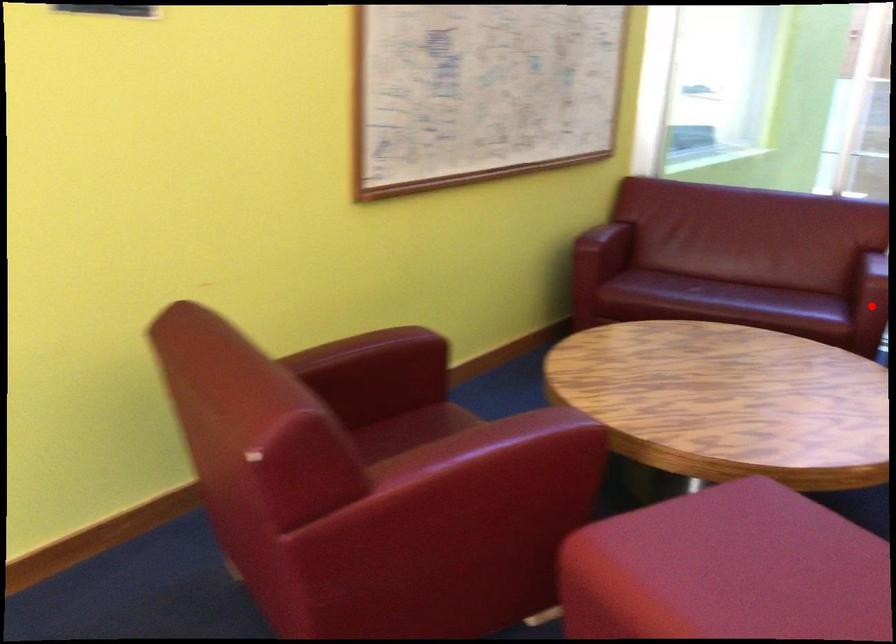
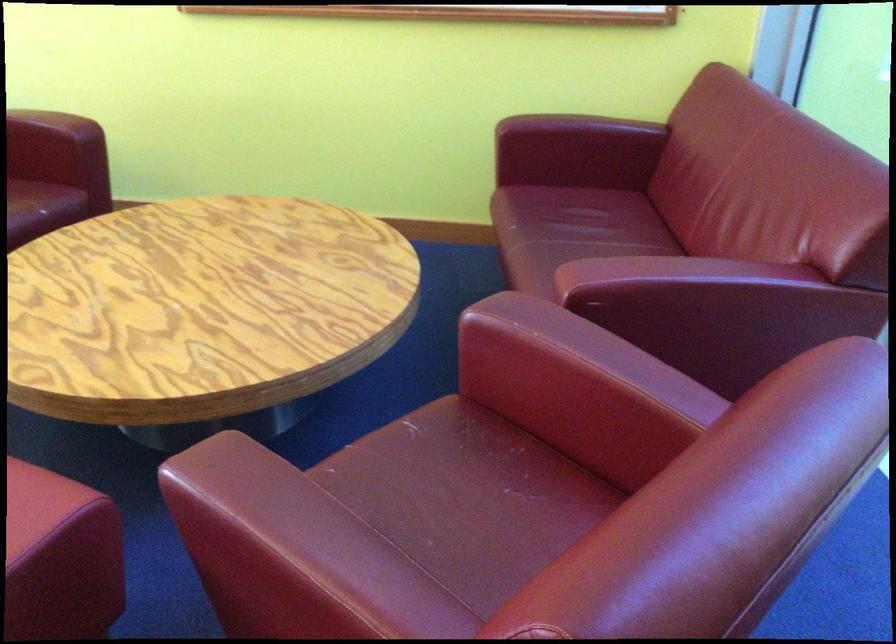
Question: I am providing you with two images of the same scene from different viewpoints. A red point is marked on the first image. Can you still see the location of the red point in image 2?

Choices:
 (A) Yes
 (B) No

Answer: (B)